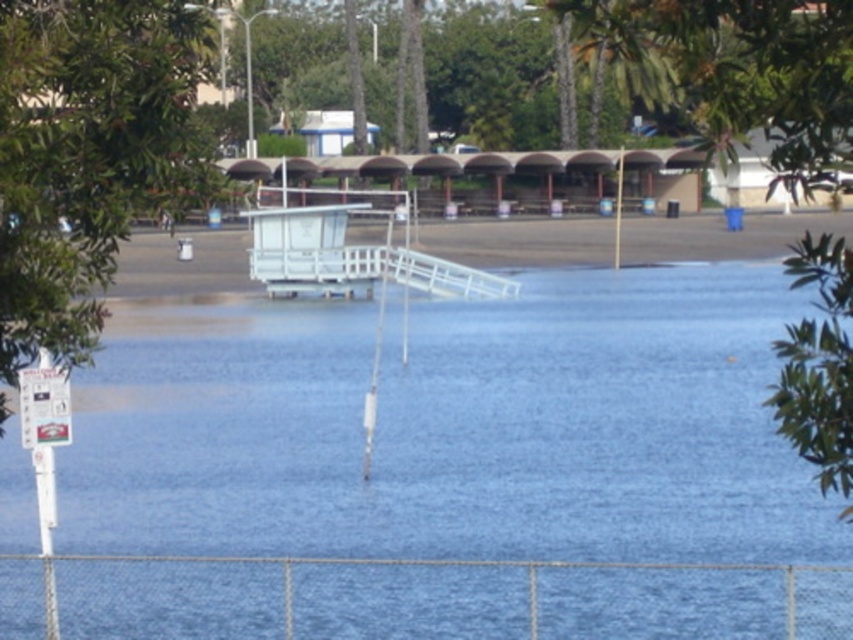
Question: Does green leafy tree at left appear over white plastic dock at center?

Choices:
 (A) yes
 (B) no

Answer: (B)

Question: Which of these objects is positioned closest to the white plastic dock at center?

Choices:
 (A) green leafy tree at left
 (B) blue water at center

Answer: (B)

Question: Based on their relative distances, which object is farther from the white plastic dock at center?

Choices:
 (A) blue water at center
 (B) green leafy tree at left

Answer: (B)

Question: Does green leafy tree at left appear under white plastic dock at center?

Choices:
 (A) yes
 (B) no

Answer: (A)

Question: Which point appears farthest from the camera in this image?

Choices:
 (A) (657, 481)
 (B) (12, 301)

Answer: (A)

Question: Does blue water at center have a lesser width compared to white plastic dock at center?

Choices:
 (A) no
 (B) yes

Answer: (B)